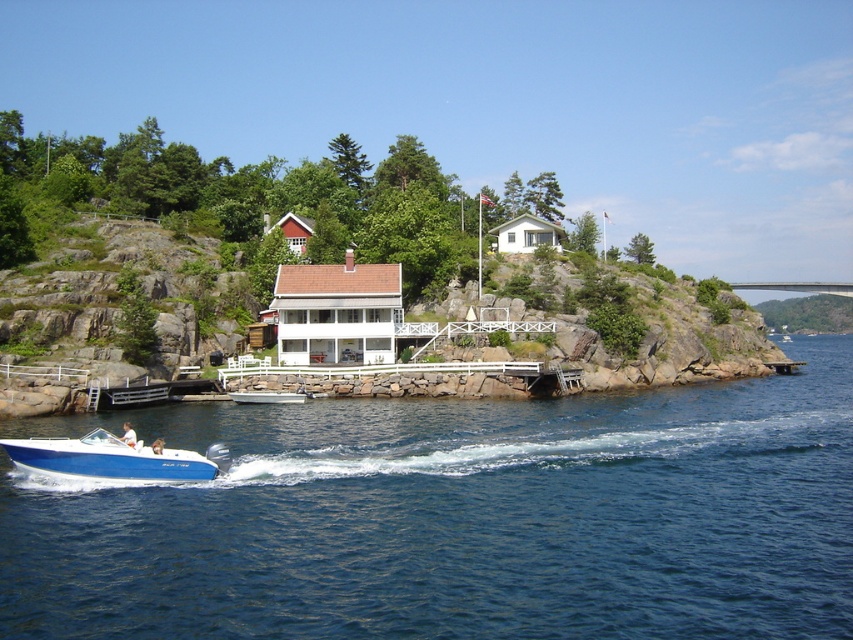
Question: Estimate the real-world distances between objects in this image. Which object is farther from the white plastic boat at center?

Choices:
 (A) blue liquid water at lower center
 (B) blue glossy boat at lower left

Answer: (A)

Question: Is blue liquid water at lower center to the right of blue glossy boat at lower left from the viewer's perspective?

Choices:
 (A) no
 (B) yes

Answer: (B)

Question: Does blue glossy boat at lower left have a lesser width compared to white plastic boat at center?

Choices:
 (A) no
 (B) yes

Answer: (A)

Question: Which point is closer to the camera taking this photo?

Choices:
 (A) (252, 400)
 (B) (49, 465)

Answer: (B)

Question: Can you confirm if blue liquid water at lower center is positioned below blue glossy boat at lower left?

Choices:
 (A) no
 (B) yes

Answer: (B)

Question: Which point is closer to the camera taking this photo?

Choices:
 (A) (254, 572)
 (B) (149, 461)

Answer: (A)